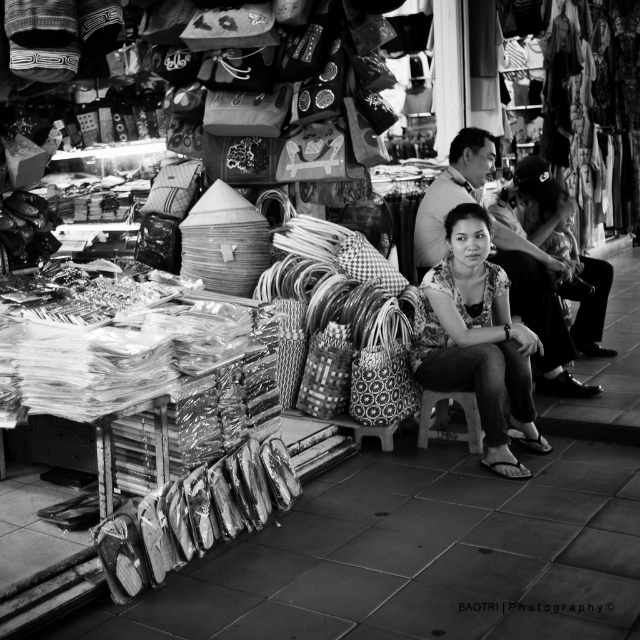
You are a customer at this market and want to buy the printed fabric blouse at center. However, you notice the wooden stool at center is blocking your view of the blouse. Can you estimate if the blouse is bigger than the stool?

The printed fabric blouse at center has a larger size compared to wooden stool at center, so yes, the blouse is bigger than the stool.

Based on the photo, you are a customer at the market and want to buy a camera. You see the smooth leather jacket at center and the camera in the scene. How far apart are they?

The smooth leather jacket at center and the camera are 5.58 meters apart from each other.

You are standing in the market and see two points marked in the image. According to their coordinates, which point is closer to you, point (536, 348) or point (524, 300)?

Point (536, 348) is in front of point (524, 300), so it is closer to you.